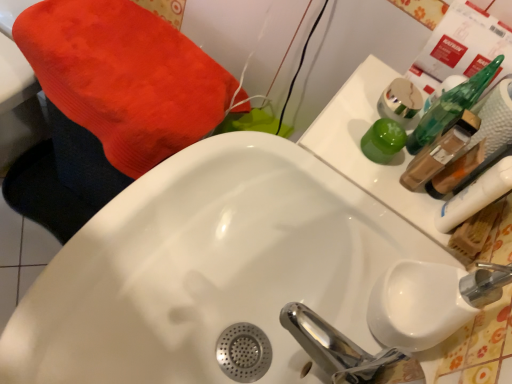
Question: Is white glossy sink at center bigger than translucent plastic mouthwash at upper right, the 2th mouthwash ordered from the bottom?

Choices:
 (A) yes
 (B) no

Answer: (A)

Question: Is white glossy sink at center aimed at translucent plastic mouthwash at upper right, the 2th mouthwash ordered from the bottom?

Choices:
 (A) no
 (B) yes

Answer: (A)

Question: Is white glossy sink at center completely or partially outside of translucent plastic mouthwash at upper right, the 2th mouthwash ordered from the bottom?

Choices:
 (A) yes
 (B) no

Answer: (A)

Question: Does white glossy sink at center have a greater height compared to translucent plastic mouthwash at upper right, the 2th mouthwash ordered from the bottom?

Choices:
 (A) yes
 (B) no

Answer: (A)

Question: Is the depth of white glossy sink at center greater than that of translucent plastic mouthwash at upper right, which is the 3th mouthwash in top-to-bottom order?

Choices:
 (A) no
 (B) yes

Answer: (A)

Question: From the image's perspective, relative to translucent plastic mouthwash at upper right, which is the 3th mouthwash in top-to-bottom order, is green glossy cup at upper right, arranged as the second mouthwash when viewed from the top, above or below?

Choices:
 (A) below
 (B) above

Answer: (B)

Question: Relative to translucent plastic mouthwash at upper right, which is the 3th mouthwash in top-to-bottom order, is green glossy cup at upper right, which is counted as the third mouthwash, starting from the bottom, in front or behind?

Choices:
 (A) front
 (B) behind

Answer: (B)

Question: Is green glossy cup at upper right, arranged as the second mouthwash when viewed from the top, bigger or smaller than translucent plastic mouthwash at upper right, the 2th mouthwash ordered from the bottom?

Choices:
 (A) small
 (B) big

Answer: (A)

Question: Is green glossy cup at upper right, arranged as the second mouthwash when viewed from the top, situated inside translucent plastic mouthwash at upper right, which is the 3th mouthwash in top-to-bottom order, or outside?

Choices:
 (A) outside
 (B) inside

Answer: (A)

Question: Is green glossy cup at upper right, arranged as the second mouthwash when viewed from the top, in front of or behind white glossy sink at center in the image?

Choices:
 (A) behind
 (B) front

Answer: (A)

Question: Would you say green glossy cup at upper right, which is counted as the third mouthwash, starting from the bottom, is inside or outside white glossy sink at center?

Choices:
 (A) inside
 (B) outside

Answer: (B)

Question: From a real-world perspective, is green glossy cup at upper right, arranged as the second mouthwash when viewed from the top, physically located above or below white glossy sink at center?

Choices:
 (A) below
 (B) above

Answer: (B)

Question: Based on their sizes in the image, would you say green glossy cup at upper right, which is counted as the third mouthwash, starting from the bottom, is bigger or smaller than white glossy sink at center?

Choices:
 (A) small
 (B) big

Answer: (A)

Question: From their relative heights in the image, would you say metallic gold mouthwash at upper right, marked as the first mouthwash in a top-to-bottom arrangement, is taller or shorter than translucent plastic mouthwash at upper right, the 2th mouthwash ordered from the bottom?

Choices:
 (A) short
 (B) tall

Answer: (A)

Question: From a real-world perspective, relative to translucent plastic mouthwash at upper right, the 2th mouthwash ordered from the bottom, is metallic gold mouthwash at upper right, which is counted as the 4th mouthwash, starting from the bottom, vertically above or below?

Choices:
 (A) below
 (B) above

Answer: (A)